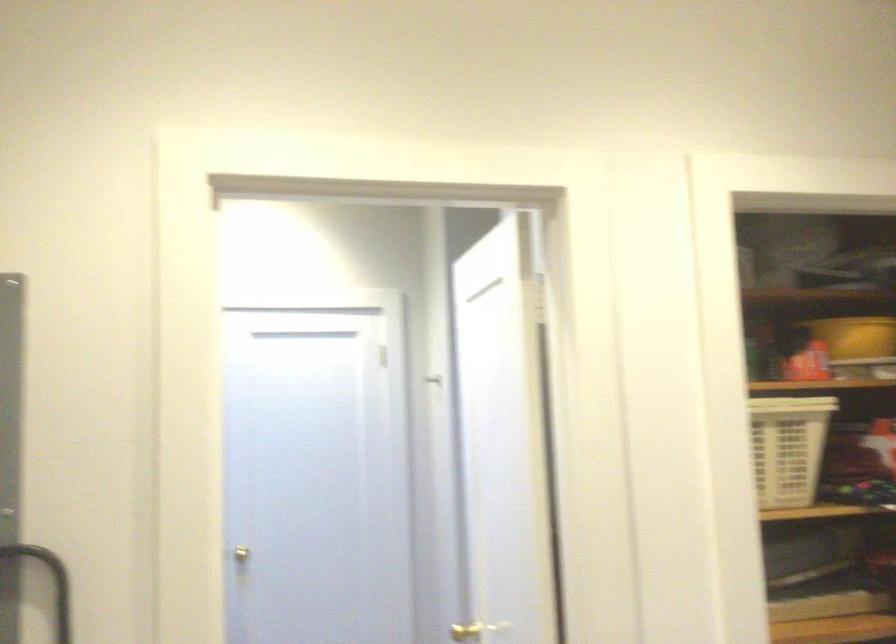
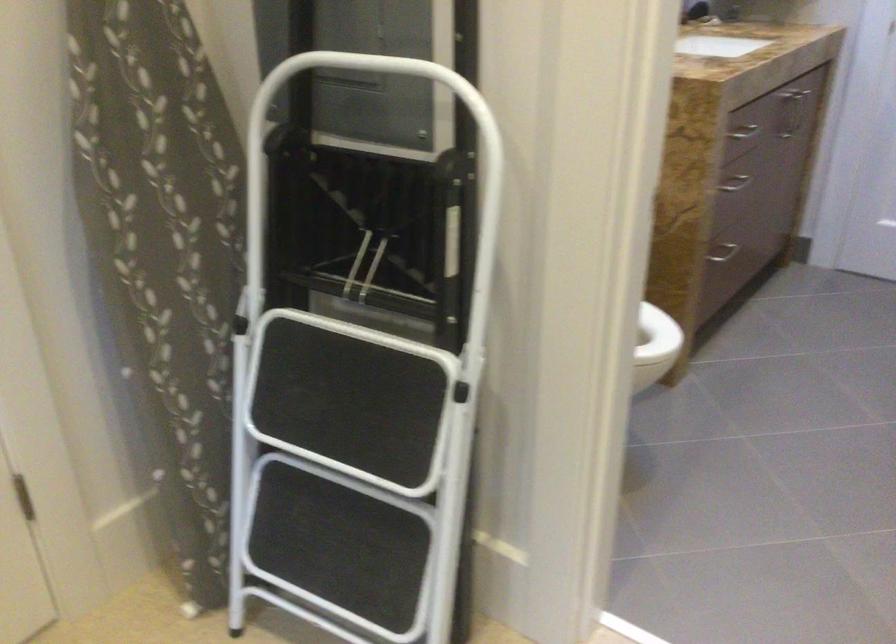
Based on the continuous images, in which direction is the camera rotating?

The camera's rotation is toward left-down.